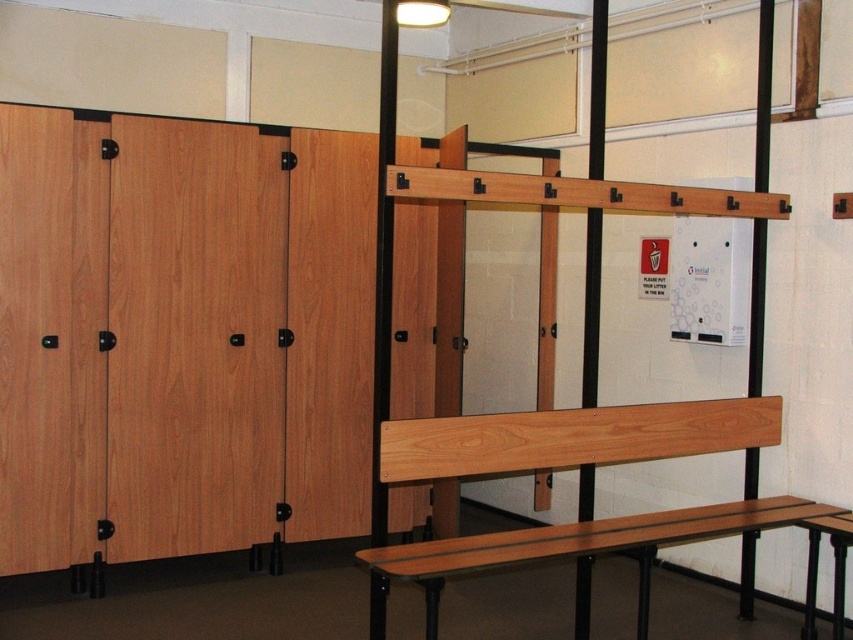
Can you confirm if natural wood bench at center is positioned to the right of wooden bench at center?

Incorrect, natural wood bench at center is not on the right side of wooden bench at center.

Which of these two, natural wood bench at center or wooden bench at center, stands taller?

wooden bench at center is taller.

Between point (497, 532) and point (814, 522), which one is positioned in front?

Point (814, 522) is in front.

You are a GUI agent. You are given a task and a screenshot of the screen. Output one action in this format:
    pyautogui.click(x=<x>, y=<y>)
    Task: Click on the natural wood bench at center
    This screenshot has width=853, height=640.
    Given the screenshot: What is the action you would take?
    pyautogui.click(x=573, y=436)